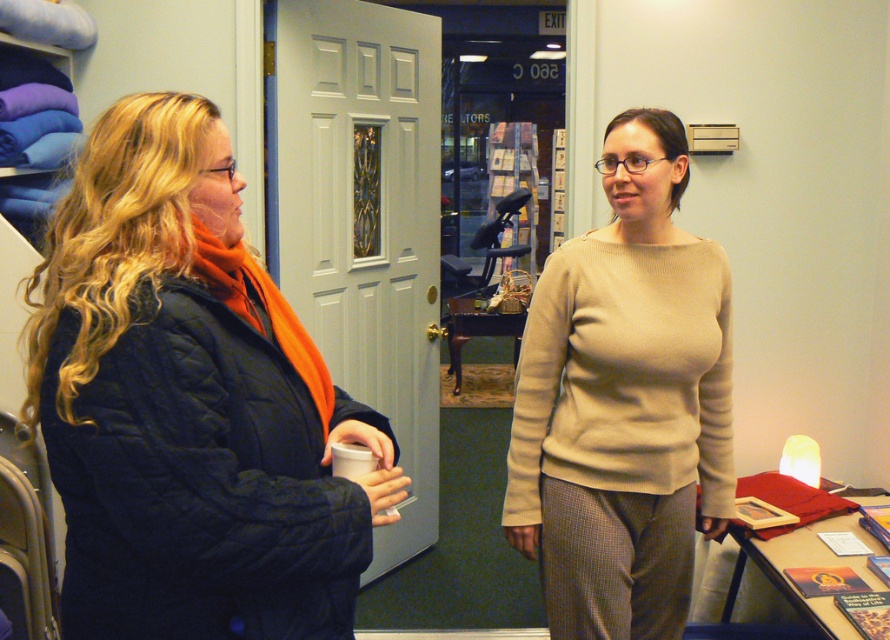
Does point (374, 497) come closer to viewer compared to point (613, 627)?

Yes, it is in front of point (613, 627).

Does point (69, 570) lie behind point (666, 381)?

No, (69, 570) is in front of (666, 381).

What do you see at coordinates (189, 403) in the screenshot? I see `matte black coat at left` at bounding box center [189, 403].

The height and width of the screenshot is (640, 890). I want to click on matte black coat at left, so click(189, 403).